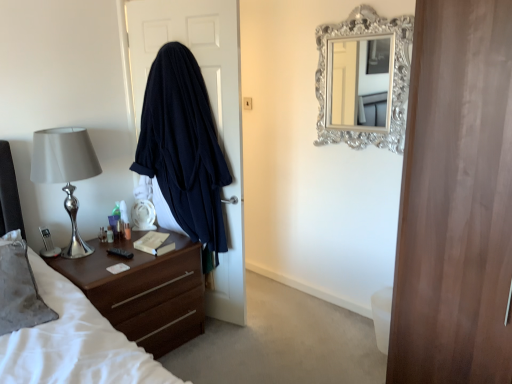
Find the location of a particular element. Image resolution: width=512 pixels, height=384 pixels. free space underneath silver metallic lamp at left (from a real-world perspective) is located at coordinates (92, 252).